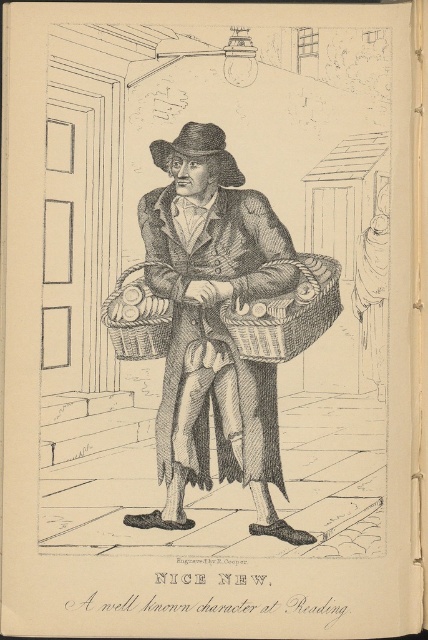
Question: Can you confirm if brown wicker basket at center is bigger than brown felt hat at center?

Choices:
 (A) no
 (B) yes

Answer: (B)

Question: Is brown wicker basket at center further to camera compared to brown felt hat at center?

Choices:
 (A) yes
 (B) no

Answer: (B)

Question: Does brown wicker basket at center appear on the left side of brown felt hat at center?

Choices:
 (A) no
 (B) yes

Answer: (A)

Question: Among these points, which one is farthest from the camera?

Choices:
 (A) [x=213, y=132]
 (B) [x=216, y=420]

Answer: (B)

Question: Which point is farther to the camera?

Choices:
 (A) brown felt hat at center
 (B) brown wicker basket at center

Answer: (A)